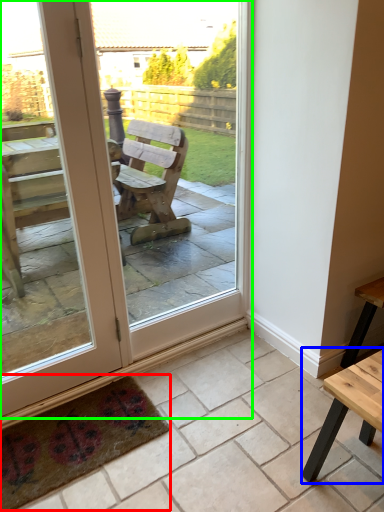
Question: Which object is positioned farthest from mat (highlighted by a red box)? Select from table (highlighted by a blue box) and door (highlighted by a green box).

Choices:
 (A) table
 (B) door

Answer: (A)